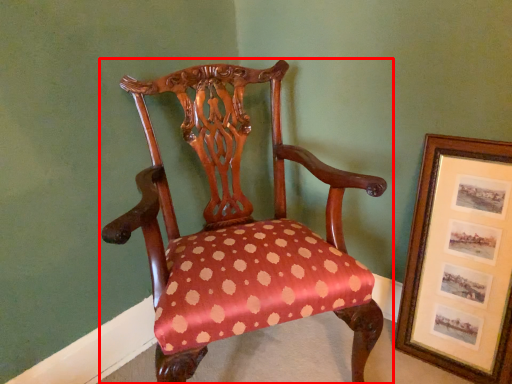
Question: From the image's perspective, where is chair (annotated by the red box) located in relation to picture frame in the image?

Choices:
 (A) above
 (B) below

Answer: (A)